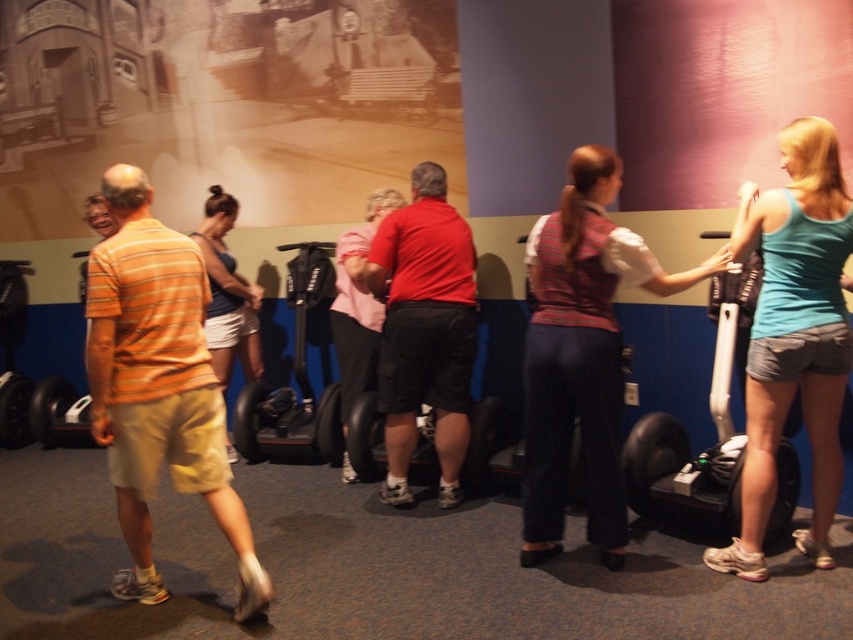
Is point (648, 273) closer to camera compared to point (428, 214)?

Yes.

Who is positioned more to the left, plaid shirt at center or red matte shirt at center?

Positioned to the left is red matte shirt at center.

Between point (601, 259) and point (418, 227), which one is positioned in front?

Point (601, 259)

You are a GUI agent. You are given a task and a screenshot of the screen. Output one action in this format:
    pyautogui.click(x=<x>, y=<y>)
    Task: Click on the plaid shirt at center
    The width and height of the screenshot is (853, 640).
    Given the screenshot: What is the action you would take?
    [582, 353]

Who is higher up, teal fabric tank top at right or white matte scooter at right?

teal fabric tank top at right

Who is more distant from viewer, (747,388) or (738,289)?

Point (738,289)

The height and width of the screenshot is (640, 853). In order to click on teal fabric tank top at right in this screenshot , I will do `click(793, 337)`.

Between red matte shirt at center and matte blue tank top at center, which one appears on the left side from the viewer's perspective?

matte blue tank top at center

Is red matte shirt at center smaller than matte blue tank top at center?

No.

Is point (409, 339) positioned behind point (236, 337)?

That is False.

Where is `red matte shirt at center`? red matte shirt at center is located at coordinates (424, 330).